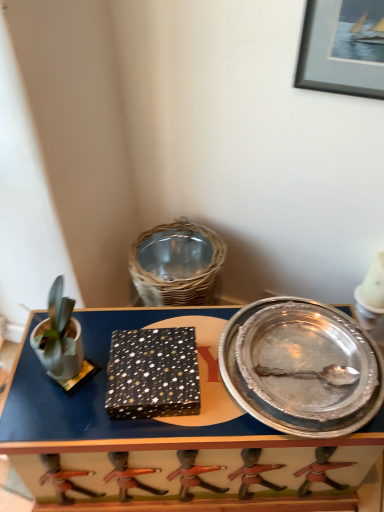
Question: Can you see black matte picture frame at upper right touching metallic silver tray at center?

Choices:
 (A) no
 (B) yes

Answer: (A)

Question: Does black matte picture frame at upper right contain metallic silver tray at center?

Choices:
 (A) no
 (B) yes

Answer: (A)

Question: Is black matte picture frame at upper right far away from metallic silver tray at center?

Choices:
 (A) yes
 (B) no

Answer: (B)

Question: Considering the relative positions of black matte picture frame at upper right and metallic silver tray at center in the image provided, is black matte picture frame at upper right to the right of metallic silver tray at center from the viewer's perspective?

Choices:
 (A) no
 (B) yes

Answer: (B)

Question: Does black matte picture frame at upper right have a larger size compared to metallic silver tray at center?

Choices:
 (A) no
 (B) yes

Answer: (A)

Question: Which is correct: silver/metallic platter at right is inside metallic silver tray at center, or outside of it?

Choices:
 (A) outside
 (B) inside

Answer: (A)

Question: From the image's perspective, is silver/metallic platter at right above or below metallic silver tray at center?

Choices:
 (A) above
 (B) below

Answer: (A)

Question: Does point (347, 359) appear closer or farther from the camera than point (160, 490)?

Choices:
 (A) closer
 (B) farther

Answer: (A)

Question: In terms of size, does silver/metallic platter at right appear bigger or smaller than metallic silver tray at center?

Choices:
 (A) big
 (B) small

Answer: (B)

Question: From a real-world perspective, relative to silver/metallic platter at right, is black matte picture frame at upper right vertically above or below?

Choices:
 (A) below
 (B) above

Answer: (B)

Question: Is black matte picture frame at upper right inside the boundaries of silver/metallic platter at right, or outside?

Choices:
 (A) outside
 (B) inside

Answer: (A)

Question: Is point (307, 40) closer or farther from the camera than point (365, 400)?

Choices:
 (A) farther
 (B) closer

Answer: (A)

Question: In terms of height, does black matte picture frame at upper right look taller or shorter compared to silver/metallic platter at right?

Choices:
 (A) short
 (B) tall

Answer: (B)

Question: Considering the positions of point (306, 481) and point (327, 422), is point (306, 481) closer or farther from the camera than point (327, 422)?

Choices:
 (A) closer
 (B) farther

Answer: (B)

Question: Is metallic silver tray at center taller or shorter than silver/metallic platter at right?

Choices:
 (A) short
 (B) tall

Answer: (B)